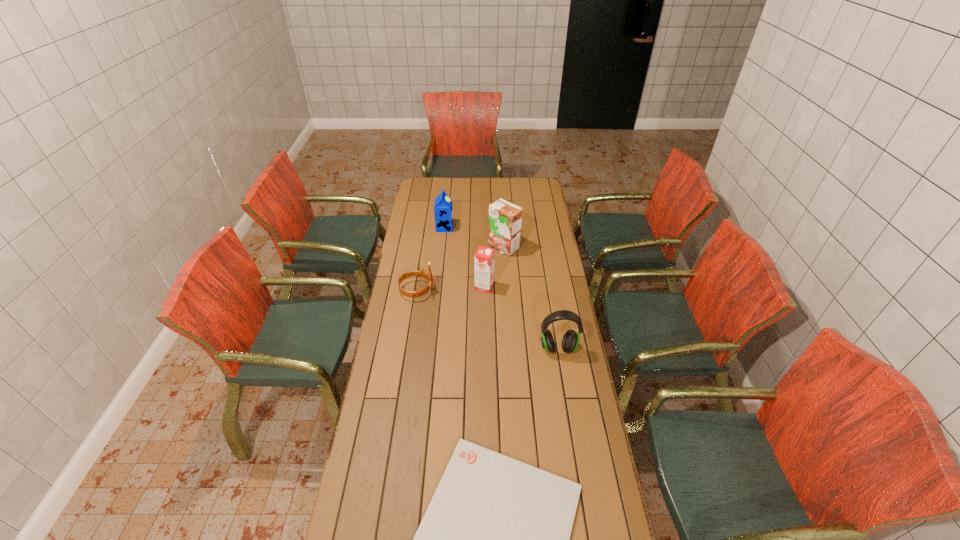
At what (x,y) coordinates should I click in order to perform the action: click on vacant area situated on the front-facing side of the tiara. Please return your answer as a coordinate pair (x, y). This screenshot has height=540, width=960. Looking at the image, I should click on (510, 291).

The image size is (960, 540). Identify the location of carton located at the left edge. (443, 211).

Where is `tiara at the left edge`? The height and width of the screenshot is (540, 960). tiara at the left edge is located at coordinates (418, 293).

In order to click on object located in the right edge section of the desktop in this screenshot , I will do `click(570, 342)`.

In the image, there is a desktop. Identify the location of vacant area at the far edge. Image resolution: width=960 pixels, height=540 pixels. (482, 191).

Find the location of a particular element. vacant space at the left edge of the desktop is located at coordinates (373, 519).

In the image, there is a desktop. Where is `vacant area at the right edge`? vacant area at the right edge is located at coordinates (541, 298).

At what (x,y) coordinates should I click in order to perform the action: click on vacant space that's between the leftmost carton and the fifth tallest object. Please return your answer as a coordinate pair (x, y). Looking at the image, I should click on (431, 259).

At what (x,y) coordinates should I click in order to perform the action: click on vacant space that's between the nearest carton and the fifth farthest object. Please return your answer as a coordinate pair (x, y). The height and width of the screenshot is (540, 960). Looking at the image, I should click on (521, 318).

Image resolution: width=960 pixels, height=540 pixels. I want to click on free point between the headset and the second farthest object, so click(531, 298).